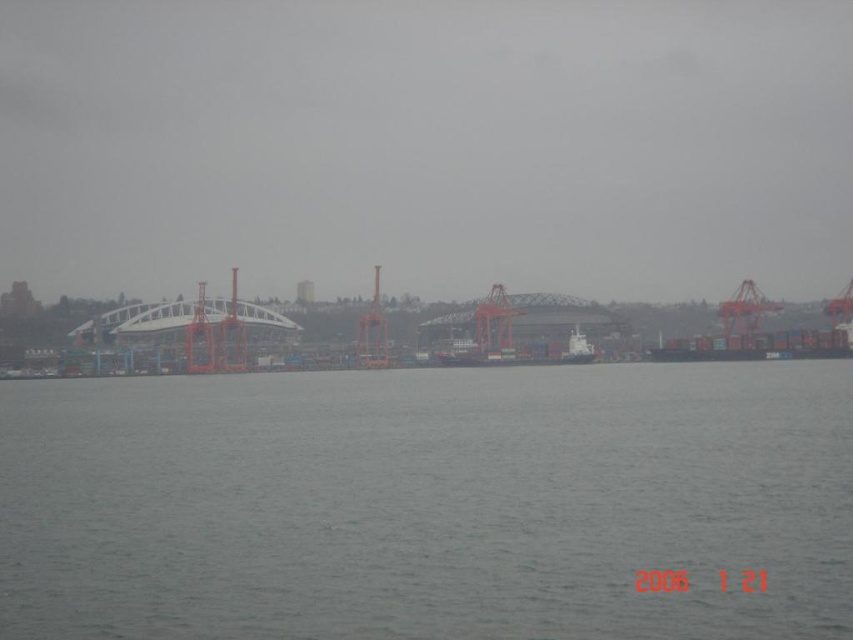
What do you see at coordinates (428, 502) in the screenshot? I see `gray water at center` at bounding box center [428, 502].

Consider the image. Does gray water at center have a lesser width compared to white matte container ship at center?

No, gray water at center is not thinner than white matte container ship at center.

Find the location of a particular element. The image size is (853, 640). gray water at center is located at coordinates (428, 502).

In the scene shown: Is white matte container ship at center to the right of orange metallic crane at right from the viewer's perspective?

In fact, white matte container ship at center is to the left of orange metallic crane at right.

Does white matte container ship at center have a greater width compared to orange metallic crane at right?

Indeed, white matte container ship at center has a greater width compared to orange metallic crane at right.

Does point (579, 342) come closer to viewer compared to point (733, 321)?

Yes.

Find the location of a particular element. The height and width of the screenshot is (640, 853). white matte container ship at center is located at coordinates (523, 355).

In the scene shown: Is gray water at center shorter than orange metallic crane at right?

Correct, gray water at center is not as tall as orange metallic crane at right.

Between point (851, 397) and point (723, 324), which one is positioned in front?

Point (851, 397) is in front.

Locate an element on the screen. gray water at center is located at coordinates (428, 502).